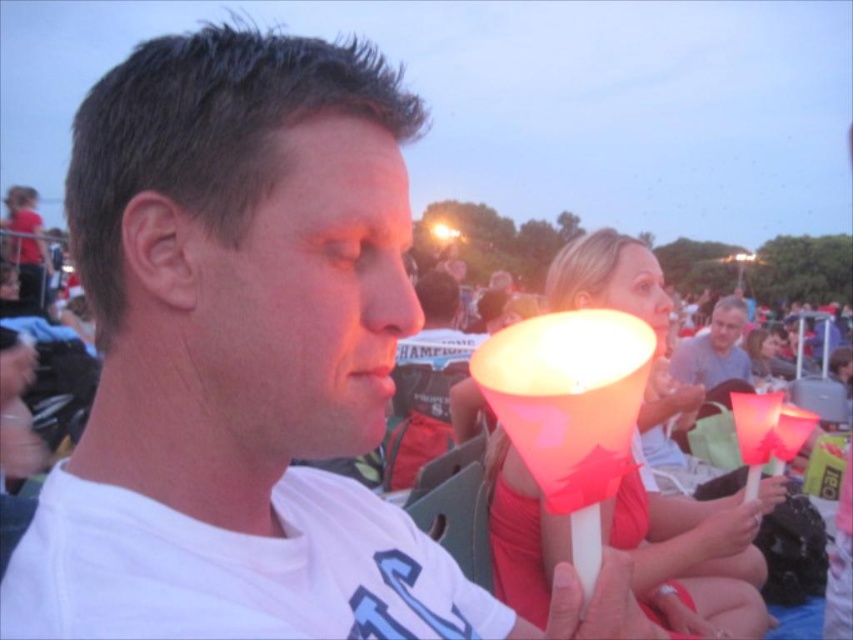
Question: Can you confirm if translucent plastic lamp at center is wider than matte plastic cone at center?

Choices:
 (A) no
 (B) yes

Answer: (A)

Question: Observing the image, what is the correct spatial positioning of translucent plastic lamp at center in reference to matte plastic cone at center?

Choices:
 (A) right
 (B) left

Answer: (B)

Question: In this image, where is translucent plastic lamp at center located relative to matte plastic cone at center?

Choices:
 (A) above
 (B) below

Answer: (A)